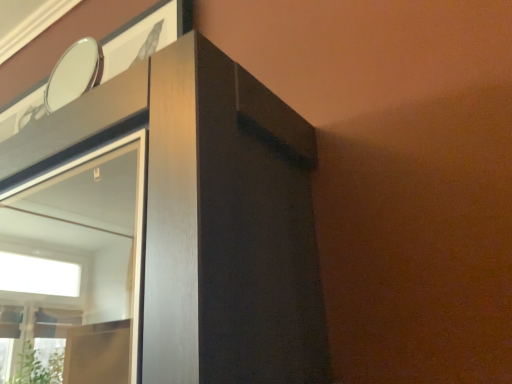
Find the location of a particular element. Image resolution: width=512 pixels, height=384 pixels. metallic silver mirror at upper left is located at coordinates (70, 77).

Describe the element at coordinates (70, 77) in the screenshot. This screenshot has width=512, height=384. I see `metallic silver mirror at upper left` at that location.

This screenshot has width=512, height=384. What do you see at coordinates (208, 215) in the screenshot?
I see `matte wood dresser at upper left` at bounding box center [208, 215].

Where is `matte wood dresser at upper left`? matte wood dresser at upper left is located at coordinates (208, 215).

In order to face matte wood dresser at upper left, should I rotate leftwards or rightwards?

You should look left and rotate roughly 26.376 degrees.

Measure the distance between matte wood dresser at upper left and camera.

14.58 inches.

Identify the location of metallic silver mirror at upper left. The width and height of the screenshot is (512, 384). (70, 77).

Based on the photo, considering the relative positions of matte wood dresser at upper left and metallic silver mirror at upper left in the image provided, is matte wood dresser at upper left to the right of metallic silver mirror at upper left from the viewer's perspective?

In fact, matte wood dresser at upper left is to the left of metallic silver mirror at upper left.

Considering the positions of objects matte wood dresser at upper left and metallic silver mirror at upper left in the image provided, who is behind, matte wood dresser at upper left or metallic silver mirror at upper left?

metallic silver mirror at upper left is further away from the camera.

Which is closer to the camera, (x=151, y=354) or (x=28, y=119)?

Point (x=151, y=354) is positioned closer to the camera compared to point (x=28, y=119).

From the image's perspective, is matte wood dresser at upper left positioned above or below metallic silver mirror at upper left?

Clearly, from the image's perspective, matte wood dresser at upper left is below metallic silver mirror at upper left.

From a real-world perspective, is matte wood dresser at upper left above or below metallic silver mirror at upper left?

From a real-world perspective, matte wood dresser at upper left is physically below metallic silver mirror at upper left.

Between matte wood dresser at upper left and metallic silver mirror at upper left, which one has smaller width?

metallic silver mirror at upper left.

Can you confirm if matte wood dresser at upper left is shorter than metallic silver mirror at upper left?

No, matte wood dresser at upper left is not shorter than metallic silver mirror at upper left.

Considering the sizes of objects matte wood dresser at upper left and metallic silver mirror at upper left in the image provided, who is smaller, matte wood dresser at upper left or metallic silver mirror at upper left?

metallic silver mirror at upper left is smaller.

Do you think matte wood dresser at upper left is within metallic silver mirror at upper left, or outside of it?

matte wood dresser at upper left is not inside metallic silver mirror at upper left, it's outside.

Consider the image. Is there a large distance between matte wood dresser at upper left and metallic silver mirror at upper left?

They are positioned close to each other.

Is matte wood dresser at upper left oriented away from metallic silver mirror at upper left?

matte wood dresser at upper left does not have its back to metallic silver mirror at upper left.

Measure the distance between matte wood dresser at upper left and metallic silver mirror at upper left.

75.13 centimeters.

Where is `mirror on the right of matte wood dresser at upper left`? The height and width of the screenshot is (384, 512). mirror on the right of matte wood dresser at upper left is located at coordinates (70, 77).

Consider the image. Which object is positioned more to the left, metallic silver mirror at upper left or matte wood dresser at upper left?

From the viewer's perspective, matte wood dresser at upper left appears more on the left side.

Relative to matte wood dresser at upper left, is metallic silver mirror at upper left in front or behind?

Visually, metallic silver mirror at upper left is located behind matte wood dresser at upper left.

Is point (50, 104) closer or farther from the camera than point (122, 76)?

Point (50, 104).

From the image's perspective, does metallic silver mirror at upper left appear lower than matte wood dresser at upper left?

Incorrect, from the image's perspective, metallic silver mirror at upper left is higher than matte wood dresser at upper left.

From a real-world perspective, is metallic silver mirror at upper left positioned under matte wood dresser at upper left based on gravity?

No, from a real-world perspective, metallic silver mirror at upper left is not beneath matte wood dresser at upper left.

Which object is thinner, metallic silver mirror at upper left or matte wood dresser at upper left?

Thinner between the two is metallic silver mirror at upper left.

Considering the sizes of objects metallic silver mirror at upper left and matte wood dresser at upper left in the image provided, who is shorter, metallic silver mirror at upper left or matte wood dresser at upper left?

metallic silver mirror at upper left is shorter.

Between metallic silver mirror at upper left and matte wood dresser at upper left, which one has smaller size?

With smaller size is metallic silver mirror at upper left.

Is metallic silver mirror at upper left not within matte wood dresser at upper left?

metallic silver mirror at upper left lies outside matte wood dresser at upper left's area.

Is metallic silver mirror at upper left next to matte wood dresser at upper left?

No, metallic silver mirror at upper left is not touching matte wood dresser at upper left.

Is metallic silver mirror at upper left looking in the opposite direction of matte wood dresser at upper left?

No, metallic silver mirror at upper left is not facing the opposite direction of matte wood dresser at upper left.

This screenshot has width=512, height=384. I want to click on dresser that appears below the metallic silver mirror at upper left (from a real-world perspective), so click(208, 215).

Where is `dresser below the metallic silver mirror at upper left (from the image's perspective)`? dresser below the metallic silver mirror at upper left (from the image's perspective) is located at coordinates (208, 215).

This screenshot has height=384, width=512. There is a matte wood dresser at upper left. Find the location of `mirror above it (from a real-world perspective)`. mirror above it (from a real-world perspective) is located at coordinates (70, 77).